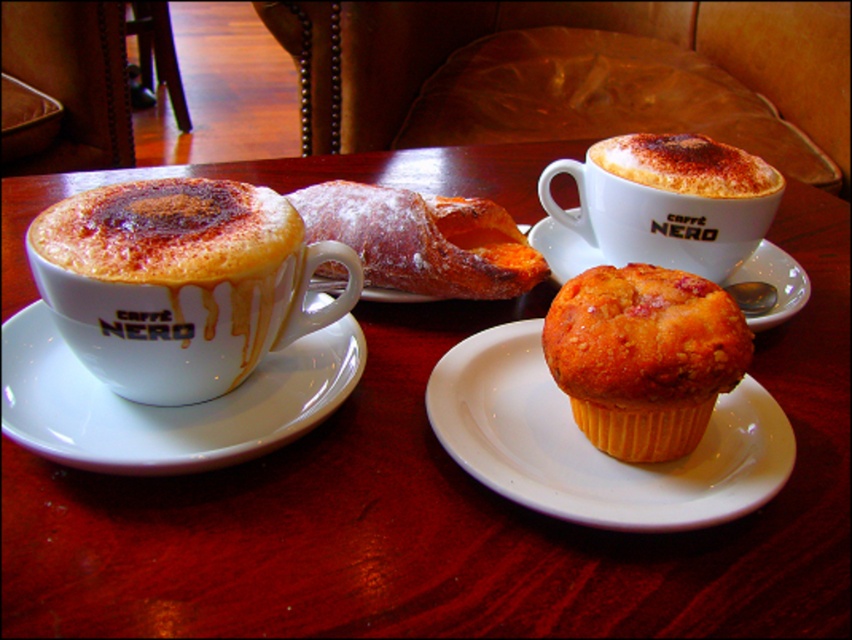
Question: Is matte white cup at left positioned behind golden-brown muffin at center-right?

Choices:
 (A) no
 (B) yes

Answer: (A)

Question: Is yellow paper cupcake at center wider than matte white cup at upper right?

Choices:
 (A) yes
 (B) no

Answer: (A)

Question: Can you confirm if yellow paper cupcake at center is positioned above matte white cup at upper right?

Choices:
 (A) yes
 (B) no

Answer: (B)

Question: Among these points, which one is nearest to the camera?

Choices:
 (A) (684, 468)
 (B) (694, 144)

Answer: (A)

Question: Which is farther from the matte white cup at upper right?

Choices:
 (A) cappuccino foam at upper center
 (B) golden brown sugar-coated pastry at center
 (C) white ceramic saucer at left

Answer: (C)

Question: Which point appears farthest from the camera in this image?

Choices:
 (A) [432, 268]
 (B) [750, 509]
 (C) [655, 161]

Answer: (C)